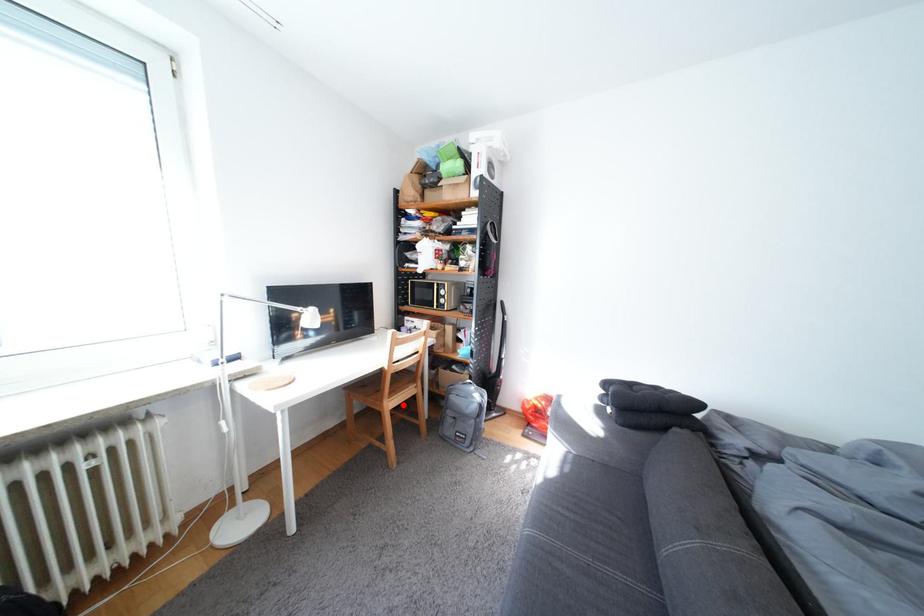
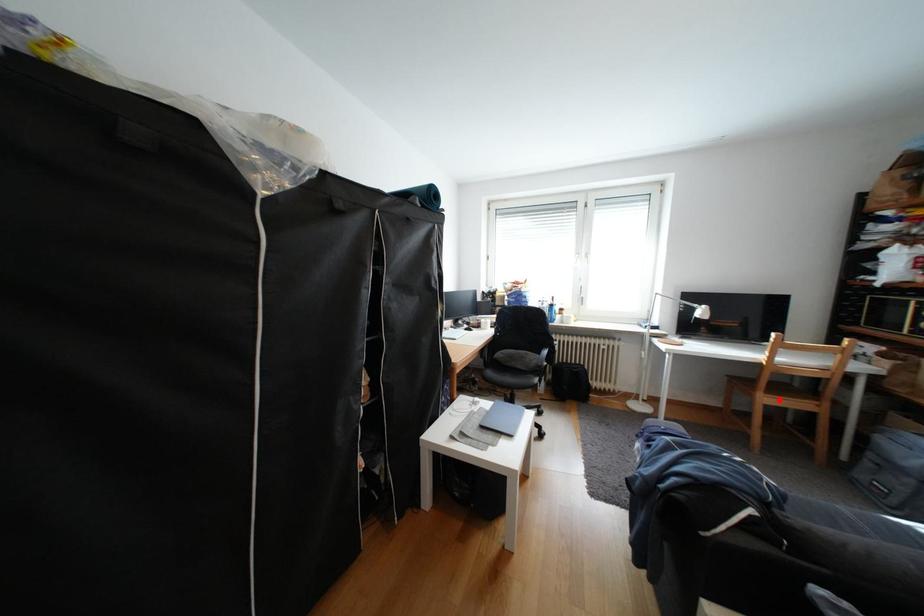
I am providing you with two images of the same scene from different viewpoints. A red point is marked on the first image and another point is marked on the second image. Are the points marked in image1 and image2 representing the same 3D position?

Yes